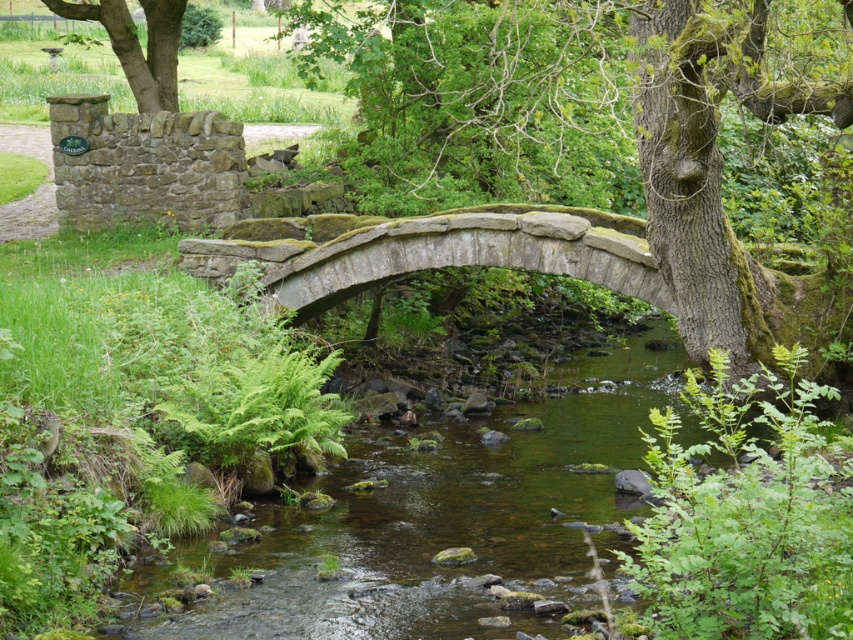
Question: Where is green mossy river at center located in relation to green mossy tree at upper left in the image?

Choices:
 (A) above
 (B) below

Answer: (B)

Question: Does green mossy river at center appear under green mossy bark tree at center?

Choices:
 (A) no
 (B) yes

Answer: (B)

Question: Which point is closer to the camera?

Choices:
 (A) (843, 106)
 (B) (606, 412)
 (C) (171, 19)

Answer: (A)

Question: Which point is closer to the camera?

Choices:
 (A) 614,499
 (B) 682,163
 (C) 100,4

Answer: (B)

Question: Can you confirm if green mossy river at center is smaller than green mossy bark tree at center?

Choices:
 (A) no
 (B) yes

Answer: (B)

Question: Among these objects, which one is nearest to the camera?

Choices:
 (A) green mossy tree at upper left
 (B) green mossy river at center
 (C) green mossy bark tree at center

Answer: (C)